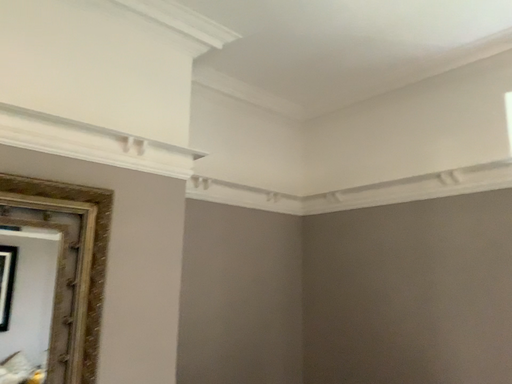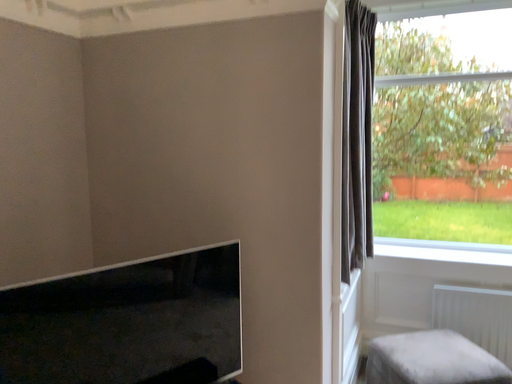
Question: How did the camera likely rotate when shooting the video?

Choices:
 (A) rotated left
 (B) rotated right

Answer: (B)